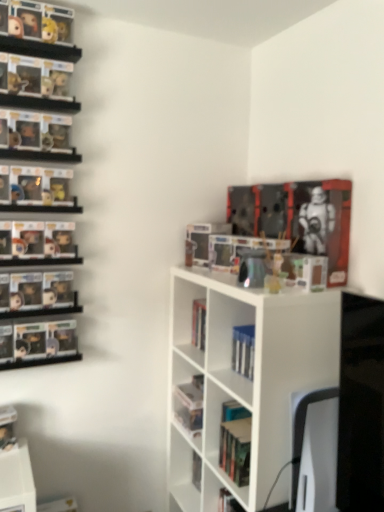
Question: Considering the positions of metallic silver robot at upper right, which is the 2th book in left-to-right order, and white matte bookshelf at center in the image, is metallic silver robot at upper right, which is the 2th book in left-to-right order, wider or thinner than white matte bookshelf at center?

Choices:
 (A) thin
 (B) wide

Answer: (A)

Question: Is metallic silver robot at upper right, which is the 2th book in left-to-right order, inside the boundaries of white matte bookshelf at center, or outside?

Choices:
 (A) inside
 (B) outside

Answer: (B)

Question: Which object is positioned farthest from the metallic silver robot at upper right, which is the 2th book in left-to-right order?

Choices:
 (A) white matte bookshelf at center
 (B) blue hardcover book at center, acting as the 1th book starting from the left

Answer: (B)

Question: Which is nearer to the blue hardcover book at center, acting as the 1th book starting from the left?

Choices:
 (A) metallic silver robot at upper right, placed as the second book when sorted from bottom to top
 (B) white matte bookshelf at center

Answer: (B)